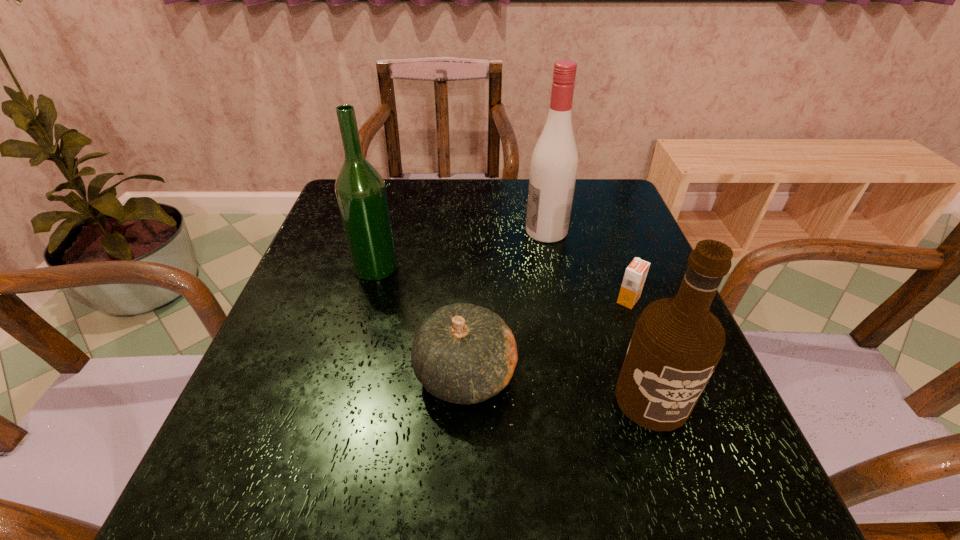
Locate an element on the screen. the farthest object is located at coordinates (554, 163).

Locate an element on the screen. the third object from right to left is located at coordinates (554, 163).

At what (x,y) coordinates should I click in order to perform the action: click on the fourth nearest object. Please return your answer as a coordinate pair (x, y). Looking at the image, I should click on (360, 190).

Where is `the second farthest alcohol`? The image size is (960, 540). the second farthest alcohol is located at coordinates (360, 190).

Locate an element on the screen. This screenshot has height=540, width=960. the shortest alcohol is located at coordinates (677, 342).

Identify the location of the third shortest object. This screenshot has width=960, height=540. (677, 342).

I want to click on the second object from left to right, so click(x=464, y=354).

The height and width of the screenshot is (540, 960). Find the location of `gourd`. gourd is located at coordinates (464, 354).

You are a GUI agent. You are given a task and a screenshot of the screen. Output one action in this format:
    pyautogui.click(x=<x>, y=<y>)
    Task: Click on the shortest object
    The image size is (960, 540).
    Given the screenshot: What is the action you would take?
    pyautogui.click(x=635, y=275)

What are the coordinates of `the third nearest object` in the screenshot? It's located at (635, 275).